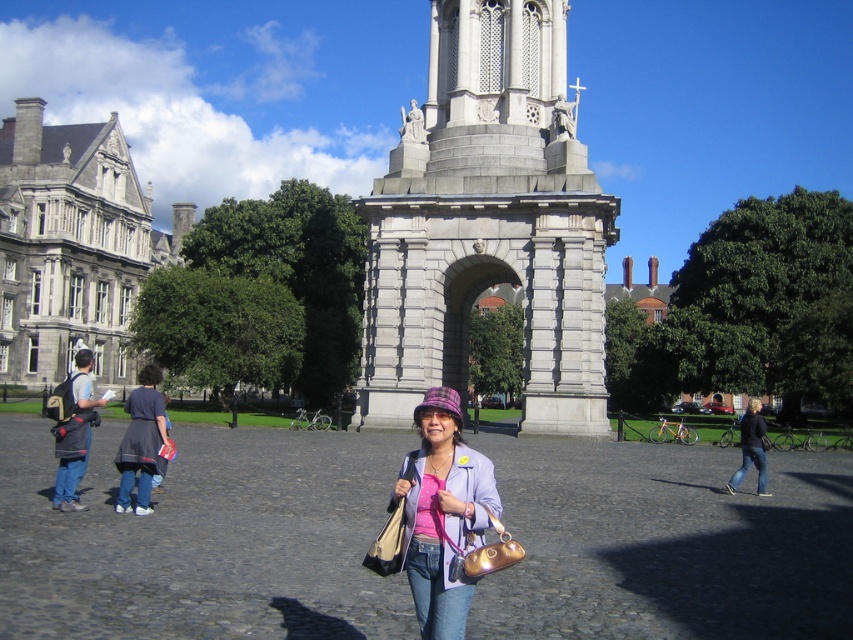
You are a photographer trying to capture the entire scene in one shot. You notice two points marked in the image. The first point is at coordinate point [433,552] and the second is at point [90,380]. Which of these points is nearer to the camera?

Point [433,552] is closer to the camera than point [90,380].

You are a photographer trying to capture the woman in the light purple jacket and the denim jacket at left. Where should you position your camera to ensure both subjects are in frame?

To capture both the woman in the light purple jacket and the denim jacket at left, position the camera such that the denim jacket at left is placed at coordinates approximately 0.672 along the x and 0.087 along the y axis. This ensures both subjects are within the frame.